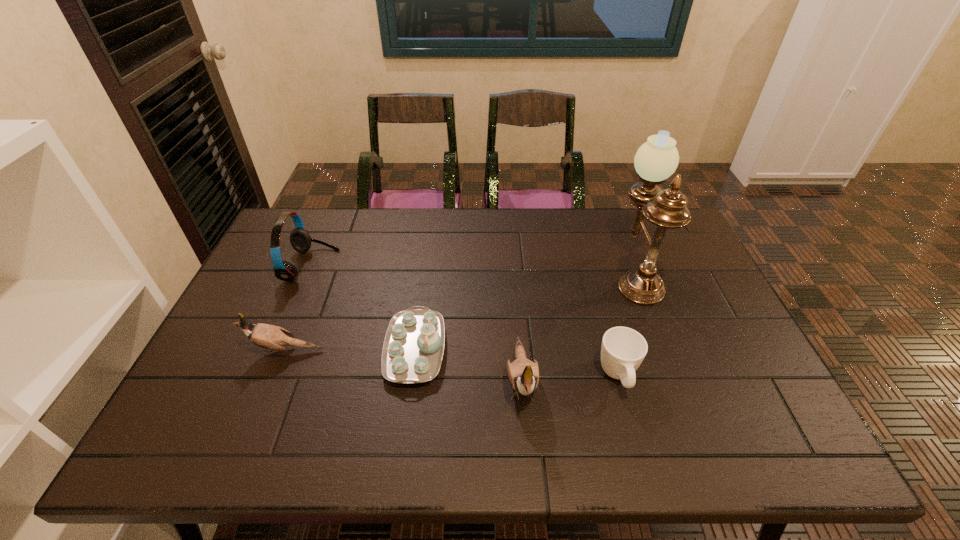
Image resolution: width=960 pixels, height=540 pixels. What are the coordinates of `blank space that satisfies the following two spatial constraints: 1. with the microphone attached to the side of the headset; 2. on the back side of the chinaware` in the screenshot? It's located at (276, 349).